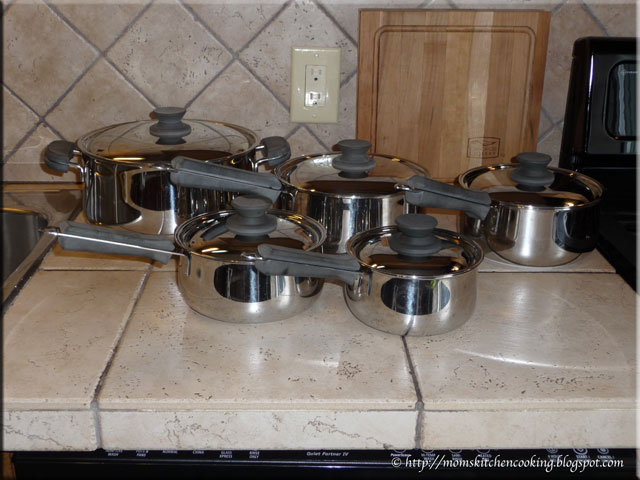
You are a GUI agent. You are given a task and a screenshot of the screen. Output one action in this format:
    pyautogui.click(x=<x>, y=<y>)
    Task: Click on the cutting board
    The width and height of the screenshot is (640, 480).
    Given the screenshot: What is the action you would take?
    pyautogui.click(x=420, y=65)